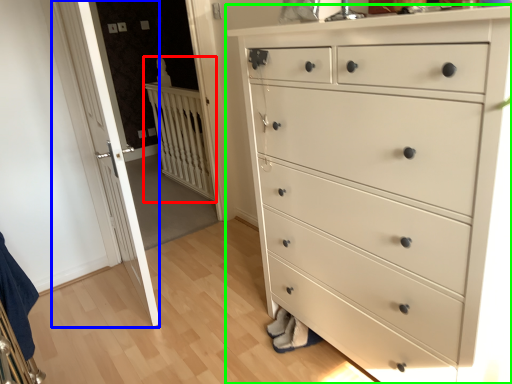
Question: Which object is positioned closest to balustrade (highlighted by a red box)? Select from door (highlighted by a blue box) and chest of drawers (highlighted by a green box).

Choices:
 (A) door
 (B) chest of drawers

Answer: (A)